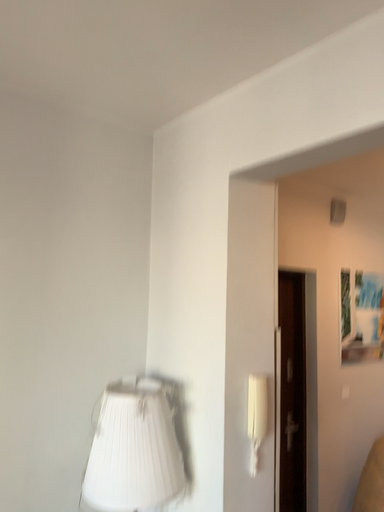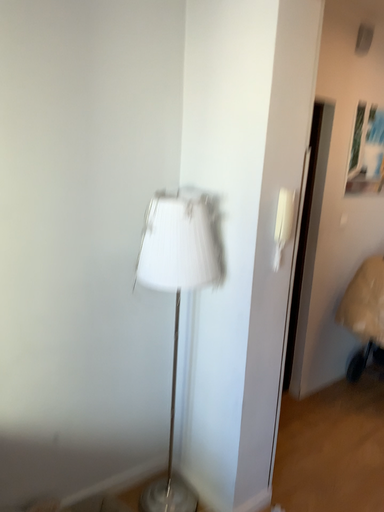
Question: How did the camera likely rotate when shooting the video?

Choices:
 (A) rotated upward
 (B) rotated downward

Answer: (B)